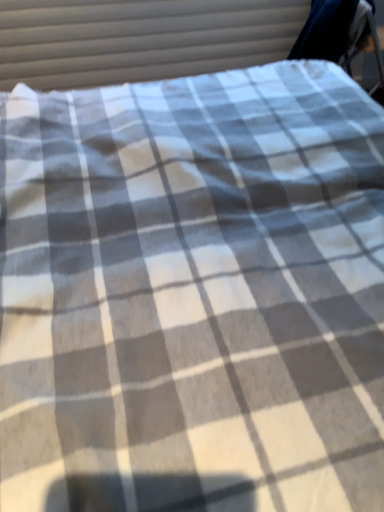
Find the location of a particular element. This screenshot has width=384, height=512. white checkered fabric at upper center is located at coordinates (139, 39).

Image resolution: width=384 pixels, height=512 pixels. Describe the element at coordinates (139, 39) in the screenshot. I see `white checkered fabric at upper center` at that location.

This screenshot has width=384, height=512. What are the coordinates of `dark blue fabric swivel chair at upper right` in the screenshot? It's located at pos(338,33).

The width and height of the screenshot is (384, 512). What do you see at coordinates (338, 33) in the screenshot? I see `dark blue fabric swivel chair at upper right` at bounding box center [338, 33].

Identify the location of white checkered fabric at upper center. (139, 39).

Is dark blue fabric swivel chair at upper right at the left side of white checkered fabric at upper center?

Incorrect, dark blue fabric swivel chair at upper right is not on the left side of white checkered fabric at upper center.

Which object is closer to the camera taking this photo, dark blue fabric swivel chair at upper right or white checkered fabric at upper center?

dark blue fabric swivel chair at upper right is closer to the camera.

Does point (323, 54) come closer to viewer compared to point (74, 10)?

No, it is not.

From the image's perspective, is dark blue fabric swivel chair at upper right on top of white checkered fabric at upper center?

Yes, from the image's perspective, dark blue fabric swivel chair at upper right is on top of white checkered fabric at upper center.

From a real-world perspective, who is located higher, dark blue fabric swivel chair at upper right or white checkered fabric at upper center?

dark blue fabric swivel chair at upper right is physically above.

Looking at this image, considering the relative sizes of dark blue fabric swivel chair at upper right and white checkered fabric at upper center in the image provided, is dark blue fabric swivel chair at upper right wider than white checkered fabric at upper center?

Yes, dark blue fabric swivel chair at upper right is wider than white checkered fabric at upper center.

Can you confirm if dark blue fabric swivel chair at upper right is shorter than white checkered fabric at upper center?

Yes, dark blue fabric swivel chair at upper right is shorter than white checkered fabric at upper center.

Looking at the image, does dark blue fabric swivel chair at upper right seem bigger or smaller compared to white checkered fabric at upper center?

Clearly, dark blue fabric swivel chair at upper right is larger in size than white checkered fabric at upper center.

Consider the image. Can we say dark blue fabric swivel chair at upper right lies outside white checkered fabric at upper center?

dark blue fabric swivel chair at upper right lies outside white checkered fabric at upper center's area.

Are dark blue fabric swivel chair at upper right and white checkered fabric at upper center far apart?

No, there isn't a large distance between dark blue fabric swivel chair at upper right and white checkered fabric at upper center.

Could you tell me if dark blue fabric swivel chair at upper right is turned towards white checkered fabric at upper center?

No, dark blue fabric swivel chair at upper right is not turned towards white checkered fabric at upper center.

Find the location of a particular element. This screenshot has width=384, height=512. curtain below the dark blue fabric swivel chair at upper right (from the image's perspective) is located at coordinates (139, 39).

Between white checkered fabric at upper center and dark blue fabric swivel chair at upper right, which one appears on the left side from the viewer's perspective?

white checkered fabric at upper center is more to the left.

Between white checkered fabric at upper center and dark blue fabric swivel chair at upper right, which one is positioned behind?

white checkered fabric at upper center is further away from the camera.

Between point (107, 67) and point (324, 45), which one is positioned behind?

The point (107, 67) is behind.

From the image's perspective, is white checkered fabric at upper center positioned above or below dark blue fabric swivel chair at upper right?

Clearly, from the image's perspective, white checkered fabric at upper center is below dark blue fabric swivel chair at upper right.

From a real-world perspective, does white checkered fabric at upper center stand above dark blue fabric swivel chair at upper right?

No, from a real-world perspective, white checkered fabric at upper center is not above dark blue fabric swivel chair at upper right.

Considering the sizes of white checkered fabric at upper center and dark blue fabric swivel chair at upper right in the image, is white checkered fabric at upper center wider or thinner than dark blue fabric swivel chair at upper right?

In the image, white checkered fabric at upper center appears to be more narrow than dark blue fabric swivel chair at upper right.

Based on the photo, can you confirm if white checkered fabric at upper center is taller than dark blue fabric swivel chair at upper right?

Correct, white checkered fabric at upper center is much taller as dark blue fabric swivel chair at upper right.

Who is bigger, white checkered fabric at upper center or dark blue fabric swivel chair at upper right?

Bigger between the two is dark blue fabric swivel chair at upper right.

Is white checkered fabric at upper center completely or partially outside of dark blue fabric swivel chair at upper right?

white checkered fabric at upper center is positioned outside dark blue fabric swivel chair at upper right.

Is white checkered fabric at upper center not close to dark blue fabric swivel chair at upper right?

No.

Could you tell me if white checkered fabric at upper center is turned towards dark blue fabric swivel chair at upper right?

Yes, white checkered fabric at upper center is turned towards dark blue fabric swivel chair at upper right.

Measure the distance between white checkered fabric at upper center and dark blue fabric swivel chair at upper right.

A distance of 57.47 centimeters exists between white checkered fabric at upper center and dark blue fabric swivel chair at upper right.

At what (x,y) coordinates should I click in order to perform the action: click on curtain below the dark blue fabric swivel chair at upper right (from the image's perspective). Please return your answer as a coordinate pair (x, y). This screenshot has height=512, width=384. Looking at the image, I should click on (139, 39).

At what (x,y) coordinates should I click in order to perform the action: click on curtain below the dark blue fabric swivel chair at upper right (from a real-world perspective). Please return your answer as a coordinate pair (x, y). This screenshot has width=384, height=512. Looking at the image, I should click on (139, 39).

You are a GUI agent. You are given a task and a screenshot of the screen. Output one action in this format:
    pyautogui.click(x=<x>, y=<y>)
    Task: Click on the swivel chair positioned vertically above the white checkered fabric at upper center (from a real-world perspective)
    The image size is (384, 512).
    Given the screenshot: What is the action you would take?
    pyautogui.click(x=338, y=33)